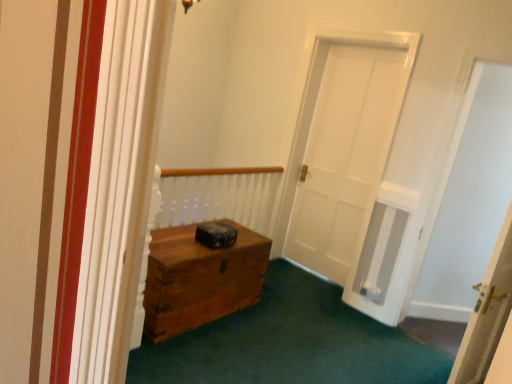
Describe the element at coordinates (487, 315) in the screenshot. I see `white wooden door at right` at that location.

I want to click on white wooden door at right, so coord(487,315).

Image resolution: width=512 pixels, height=384 pixels. What are the coordinates of `white matte door at right` in the screenshot? It's located at (467, 199).

Describe the element at coordinates (467, 199) in the screenshot. The height and width of the screenshot is (384, 512). I see `white matte door at right` at that location.

At what (x,y) coordinates should I click in order to perform the action: click on white wooden door at right. Please return your answer as a coordinate pair (x, y). This screenshot has height=384, width=512. Looking at the image, I should click on (487, 315).

Considering the relative positions of white matte door at right and white wooden door at right in the image provided, is white matte door at right to the left of white wooden door at right from the viewer's perspective?

No, white matte door at right is not to the left of white wooden door at right.

In the scene shown: Is the position of white matte door at right less distant than that of white wooden door at right?

No, the depth of white matte door at right is greater than that of white wooden door at right.

Which is closer, (490, 184) or (496, 306)?

Point (490, 184) is positioned farther from the camera compared to point (496, 306).

From the image's perspective, is white matte door at right located above white wooden door at right?

Yes, from the image's perspective, white matte door at right is over white wooden door at right.

From a real-world perspective, which object stands above the other?

From a 3D spatial view, white matte door at right is above.

Does white matte door at right have a lesser width compared to white wooden door at right?

Indeed, white matte door at right has a lesser width compared to white wooden door at right.

Which of these two, white matte door at right or white wooden door at right, stands taller?

white matte door at right.

Between white matte door at right and white wooden door at right, which one has smaller size?

white wooden door at right.

Is white wooden door at right located within white matte door at right?

No.

Would you say white matte door at right is a long distance from white wooden door at right?

white matte door at right is far away from white wooden door at right.

Could you tell me if white matte door at right is turned towards white wooden door at right?

Yes.

I want to click on door that appears below the white matte door at right (from the image's perspective), so click(487, 315).

Between white wooden door at right and white matte door at right, which one appears on the left side from the viewer's perspective?

From the viewer's perspective, white wooden door at right appears more on the left side.

Is white wooden door at right positioned in front of white matte door at right?

Yes, white wooden door at right is closer to the viewer.

Does point (482, 284) come in front of point (465, 298)?

Yes, point (482, 284) is in front of point (465, 298).

From the image's perspective, between white wooden door at right and white matte door at right, who is located below?

white wooden door at right appears lower in the image.

From a real-world perspective, between white wooden door at right and white matte door at right, who is vertically higher?

white matte door at right.

Considering the sizes of objects white wooden door at right and white matte door at right in the image provided, who is thinner, white wooden door at right or white matte door at right?

Thinner between the two is white matte door at right.

Considering the sizes of objects white wooden door at right and white matte door at right in the image provided, who is shorter, white wooden door at right or white matte door at right?

With less height is white wooden door at right.

Based on their sizes in the image, would you say white wooden door at right is bigger or smaller than white matte door at right?

In the image, white wooden door at right appears to be smaller than white matte door at right.

Would you say white matte door at right is part of white wooden door at right's contents?

No, white matte door at right is located outside of white wooden door at right.

Is white wooden door at right next to white matte door at right?

There is a gap between white wooden door at right and white matte door at right.

Is white matte door at right at the back of white wooden door at right?

white wooden door at right is not turned away from white matte door at right.

Measure the distance between white wooden door at right and white matte door at right.

The distance of white wooden door at right from white matte door at right is 3.71 feet.

You are a GUI agent. You are given a task and a screenshot of the screen. Output one action in this format:
    pyautogui.click(x=<x>, y=<y>)
    Task: Click on the door below the white matte door at right (from a real-world perspective)
    The width and height of the screenshot is (512, 384).
    Given the screenshot: What is the action you would take?
    pyautogui.click(x=487, y=315)

At what (x,y) coordinates should I click in order to perform the action: click on passage located above the white wooden door at right (from a real-world perspective). Please return your answer as a coordinate pair (x, y). The width and height of the screenshot is (512, 384). Looking at the image, I should click on (467, 199).

Where is `door that is on the left side of white matte door at right`? The width and height of the screenshot is (512, 384). door that is on the left side of white matte door at right is located at coordinates (487, 315).